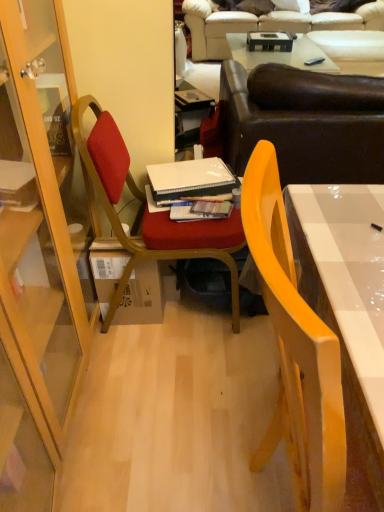
Question: Can you confirm if hardcover book at center, which is the 2th book from back to front, is wider than beige leather couch at upper center, marked as the second studio couch in a bottom-to-top arrangement?

Choices:
 (A) no
 (B) yes

Answer: (A)

Question: Considering the relative sizes of hardcover book at center, positioned as the first book in front-to-back order, and beige leather couch at upper center, marked as the second studio couch in a bottom-to-top arrangement, in the image provided, is hardcover book at center, positioned as the first book in front-to-back order, taller than beige leather couch at upper center, marked as the second studio couch in a bottom-to-top arrangement,?

Choices:
 (A) no
 (B) yes

Answer: (A)

Question: Does hardcover book at center, which is the 2th book from back to front, have a lesser height compared to beige leather couch at upper center, marked as the second studio couch in a bottom-to-top arrangement?

Choices:
 (A) yes
 (B) no

Answer: (A)

Question: From a real-world perspective, does hardcover book at center, positioned as the first book in front-to-back order, stand above beige leather couch at upper center, which appears as the second studio couch when viewed from the front?

Choices:
 (A) yes
 (B) no

Answer: (A)

Question: Does hardcover book at center, which is the 2th book from back to front, have a lesser width compared to beige leather couch at upper center, which ranks as the first studio couch in top-to-bottom order?

Choices:
 (A) no
 (B) yes

Answer: (B)

Question: From the image's perspective, does hardcover book at center, which is the 2th book from back to front, appear higher than beige leather couch at upper center, which appears as the second studio couch when viewed from the front?

Choices:
 (A) no
 (B) yes

Answer: (A)

Question: Does yellow glossy chair at right, the second chair from the back, have a greater height compared to beige leather couch at upper center, the first studio couch positioned from the back?

Choices:
 (A) yes
 (B) no

Answer: (A)

Question: Does yellow glossy chair at right, marked as the 1th chair in a front-to-back arrangement, appear on the left side of beige leather couch at upper center, the first studio couch positioned from the back?

Choices:
 (A) yes
 (B) no

Answer: (A)

Question: Can you confirm if yellow glossy chair at right, the second chair from the back, is wider than beige leather couch at upper center, marked as the second studio couch in a bottom-to-top arrangement?

Choices:
 (A) yes
 (B) no

Answer: (B)

Question: Does yellow glossy chair at right, marked as the 1th chair in a front-to-back arrangement, appear on the right side of beige leather couch at upper center, which appears as the second studio couch when viewed from the front?

Choices:
 (A) yes
 (B) no

Answer: (B)

Question: From the image's perspective, is yellow glossy chair at right, the second chair from the back, below beige leather couch at upper center, which ranks as the first studio couch in top-to-bottom order?

Choices:
 (A) no
 (B) yes

Answer: (B)

Question: Is yellow glossy chair at right, marked as the 1th chair in a front-to-back arrangement, behind beige leather couch at upper center, which appears as the second studio couch when viewed from the front?

Choices:
 (A) no
 (B) yes

Answer: (A)

Question: Is beige leather couch at upper center, marked as the second studio couch in a bottom-to-top arrangement, thinner than white matte notebook at center, the 1th book from the back?

Choices:
 (A) no
 (B) yes

Answer: (A)